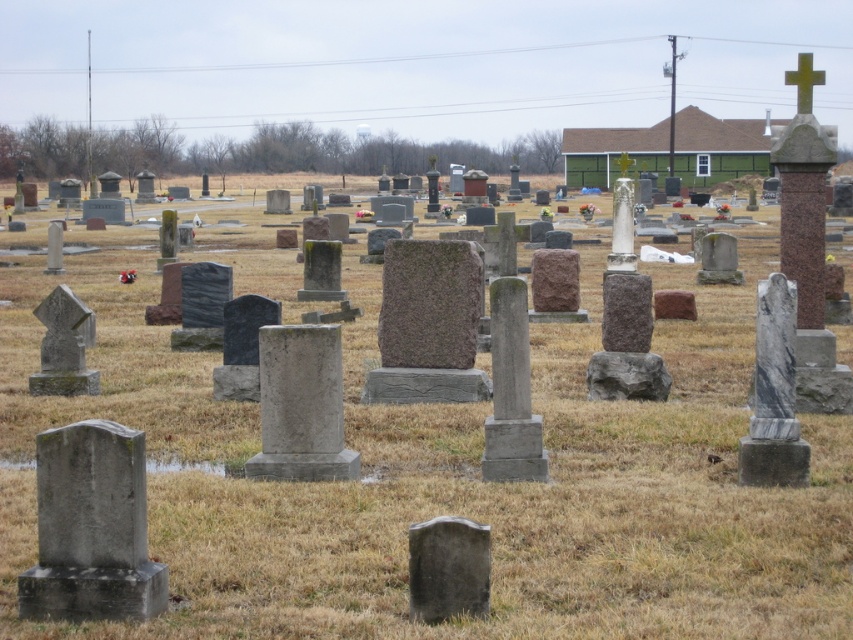
You are standing in the cemetery looking at the brown dry grass at center and the smooth gray stone at center. Which object is closer to you?

The brown dry grass at center is closer to you because it is in front of the smooth gray stone at center.

You are a gardener tasked with mowing the brown dry grass at center and placing the smooth gray stone at center into a storage shed. Which object should you handle first based on their positions?

The brown dry grass at center is above the smooth gray stone at center, so you should mow the brown dry grass at center first before moving the smooth gray stone at center to avoid stepping on the grass after mowing.

You are standing at the entrance of the cemetery and want to place a small bouquet of flowers between the smooth gray stone at center and the green polished stone cross at upper right. Based on their positions, where should you place the bouquet?

The smooth gray stone at center is positioned under the green polished stone cross at upper right, so you should place the bouquet between them, below the cross and above the gray stone.